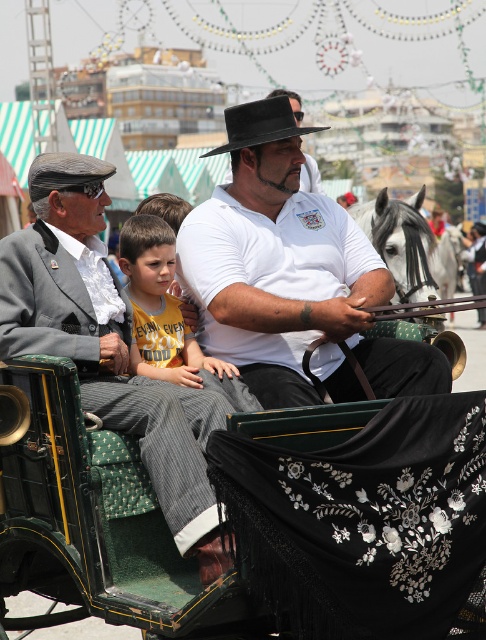
Question: Which of the following is the farthest from the observer?

Choices:
 (A) green fabric coach at left
 (B) yellow cotton shirt at center
 (C) black felt cowboy hat at center

Answer: (C)

Question: Is white matte shirt at center positioned behind yellow cotton shirt at center?

Choices:
 (A) yes
 (B) no

Answer: (A)

Question: Which point is farther to the camera?

Choices:
 (A) (74, 298)
 (B) (138, 266)

Answer: (B)

Question: Can you confirm if gray and white horse at center is positioned to the left of green fabric covered cart at center?

Choices:
 (A) no
 (B) yes

Answer: (B)

Question: Can you confirm if green fabric coach at left is thinner than green fabric covered cart at center?

Choices:
 (A) no
 (B) yes

Answer: (B)

Question: Which point is closer to the camera?

Choices:
 (A) yellow cotton shirt at center
 (B) white matte shirt at center
 (C) green fabric covered cart at center

Answer: (C)